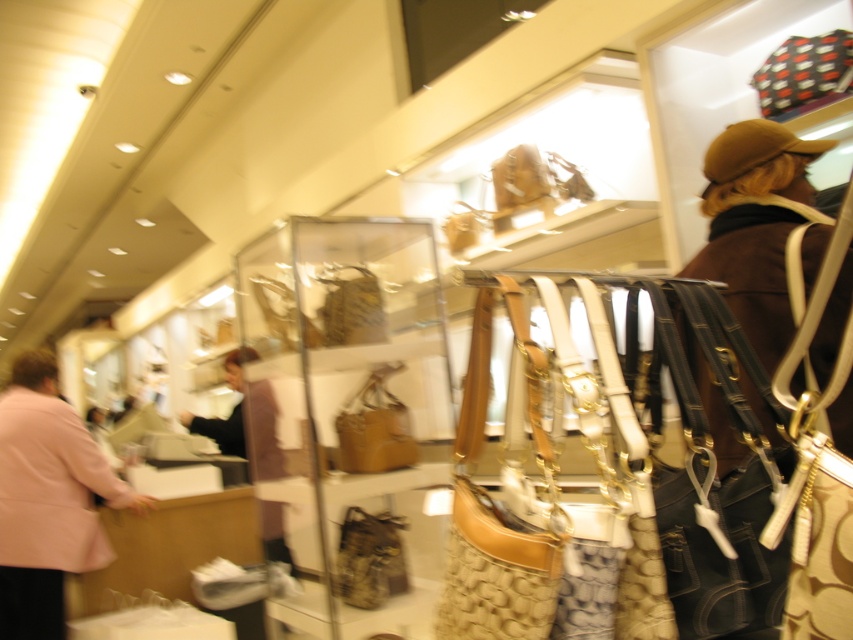
You are a customer in the store and want to see the pink fabric coat at left and the leather bag at center. Which one is taller?

The pink fabric coat at left is much taller than the leather bag at center.